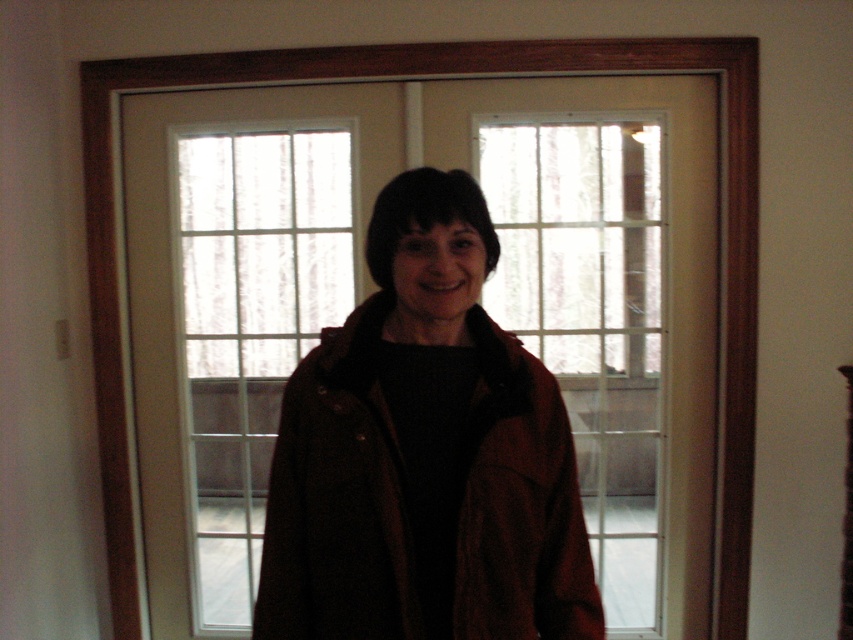
Question: Does brown leather jacket at center have a larger size compared to clear glass window at center?

Choices:
 (A) yes
 (B) no

Answer: (B)

Question: Which object is closer to the camera taking this photo?

Choices:
 (A) clear glass window at center
 (B) brown leather jacket at center

Answer: (B)

Question: Considering the relative positions of brown leather jacket at center and clear glass window at center in the image provided, where is brown leather jacket at center located with respect to clear glass window at center?

Choices:
 (A) below
 (B) above

Answer: (A)

Question: Is brown leather jacket at center below clear glass window at center?

Choices:
 (A) yes
 (B) no

Answer: (A)

Question: Among these points, which one is nearest to the camera?

Choices:
 (A) (350, 385)
 (B) (224, 184)

Answer: (A)